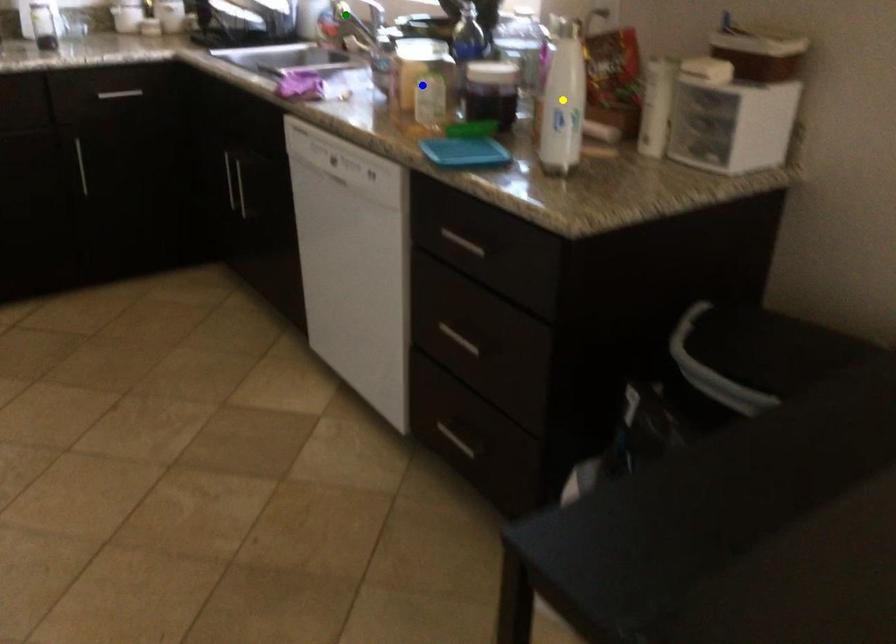
Order these from farthest to nearest:
yellow point | blue point | green point

green point, blue point, yellow point